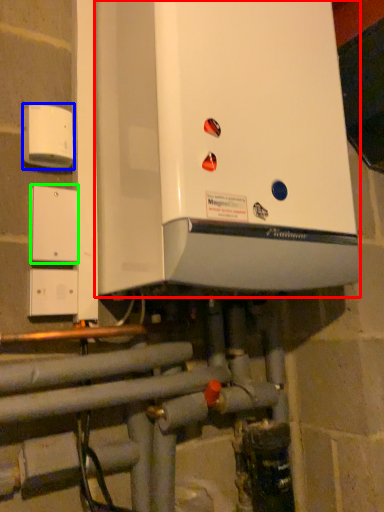
Question: Considering the real-world distances, which object is closest to home appliance (highlighted by a red box)? electric outlet (highlighted by a blue box) or light switch (highlighted by a green box).

Choices:
 (A) electric outlet
 (B) light switch

Answer: (A)